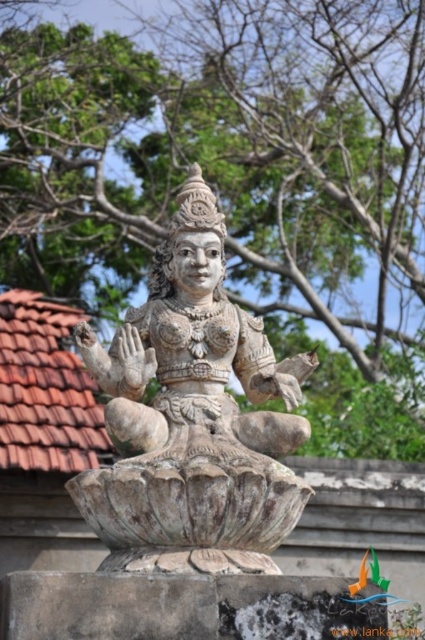
How distant is green leafy tree at upper center from stone statue at center?

green leafy tree at upper center is 50.82 meters from stone statue at center.

In the scene shown: Is green leafy tree at upper center bigger than stone statue at center?

Yes, green leafy tree at upper center is bigger than stone statue at center.

Locate an element on the screen. The width and height of the screenshot is (425, 640). green leafy tree at upper center is located at coordinates (238, 177).